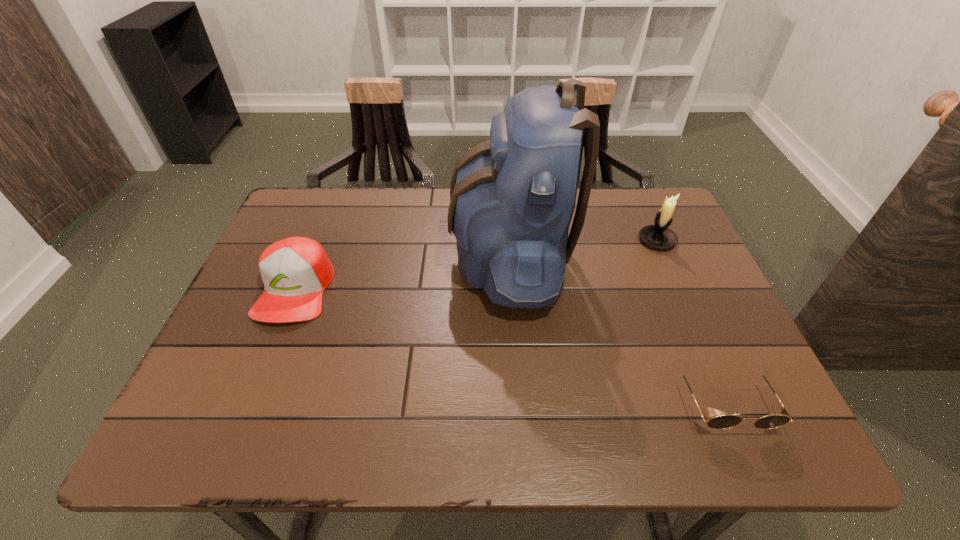
Where is `empty space that is in between the shortest object and the leftmost object`? The height and width of the screenshot is (540, 960). empty space that is in between the shortest object and the leftmost object is located at coordinates (509, 346).

You are a GUI agent. You are given a task and a screenshot of the screen. Output one action in this format:
    pyautogui.click(x=<x>, y=<y>)
    Task: Click on the empty space that is in between the backpack and the leftmost object
    
    Given the screenshot: What is the action you would take?
    coord(402,273)

Where is `blank region between the tallest object and the nearest object`? blank region between the tallest object and the nearest object is located at coordinates (616, 329).

The image size is (960, 540). In order to click on free point between the shortest object and the candle holder in this screenshot , I will do `click(690, 321)`.

This screenshot has height=540, width=960. In order to click on empty space between the backpack and the shortest object in this screenshot , I will do `click(616, 329)`.

Identify which object is located as the nearest to the baseball cap. Please provide its 2D coordinates. Your answer should be formatted as a tuple, i.e. [(x, y)], where the tuple contains the x and y coordinates of a point satisfying the conditions above.

[(512, 198)]

The height and width of the screenshot is (540, 960). What are the coordinates of `object that is the second closest one to the shortest object` in the screenshot? It's located at (659, 236).

The height and width of the screenshot is (540, 960). I want to click on vacant position in the image that satisfies the following two spatial constraints: 1. on the front side of the third shortest object; 2. at the front pocket of the third object from right to left, so click(x=663, y=256).

Locate an element on the screen. The image size is (960, 540). vacant position in the image that satisfies the following two spatial constraints: 1. at the front pocket of the second object from left to right; 2. on the front-facing side of the leftmost object is located at coordinates (512, 289).